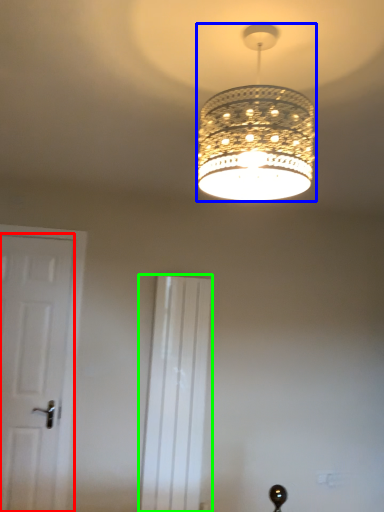
Question: Which is nearer to the door (highlighted by a red box)? lamp (highlighted by a blue box) or screen door (highlighted by a green box).

Choices:
 (A) lamp
 (B) screen door

Answer: (B)